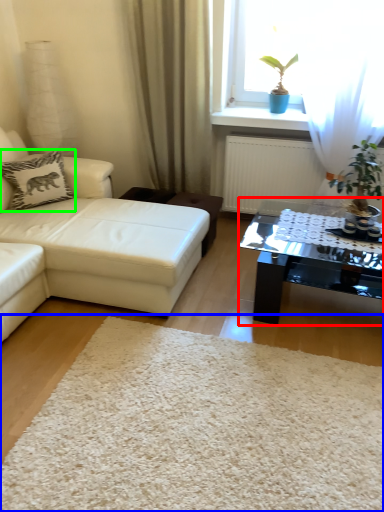
Question: Which is nearer to the coffee table (highlighted by a red box)? plain (highlighted by a blue box) or pillow (highlighted by a green box).

Choices:
 (A) plain
 (B) pillow

Answer: (A)